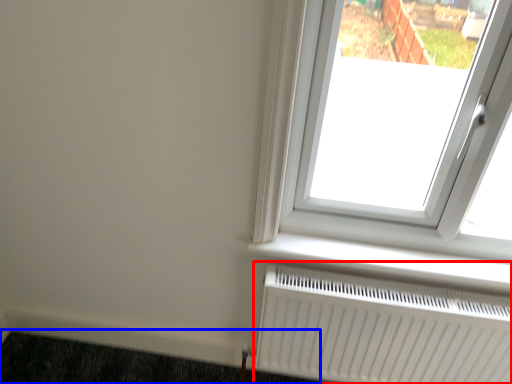
Question: Which object is closer to the camera taking this photo, radiator (highlighted by a red box) or doormat (highlighted by a blue box)?

Choices:
 (A) radiator
 (B) doormat

Answer: (A)